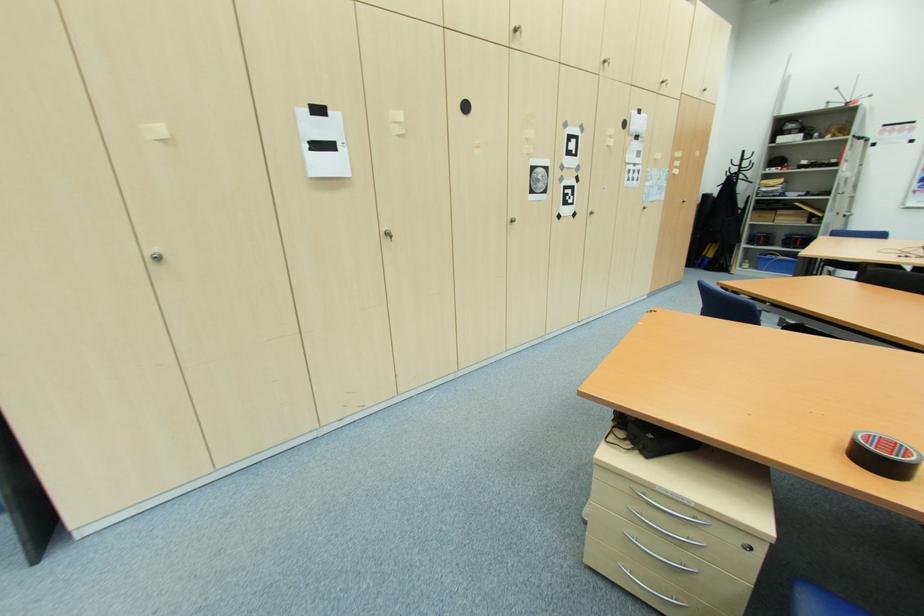
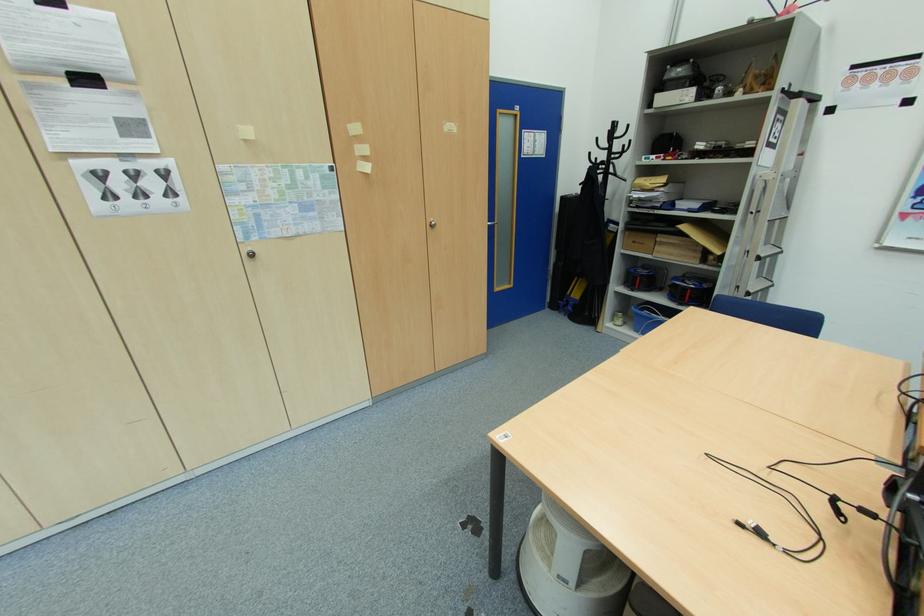
The point at (761, 246) is marked in the first image. Where is the corresponding point in the second image?

(637, 291)